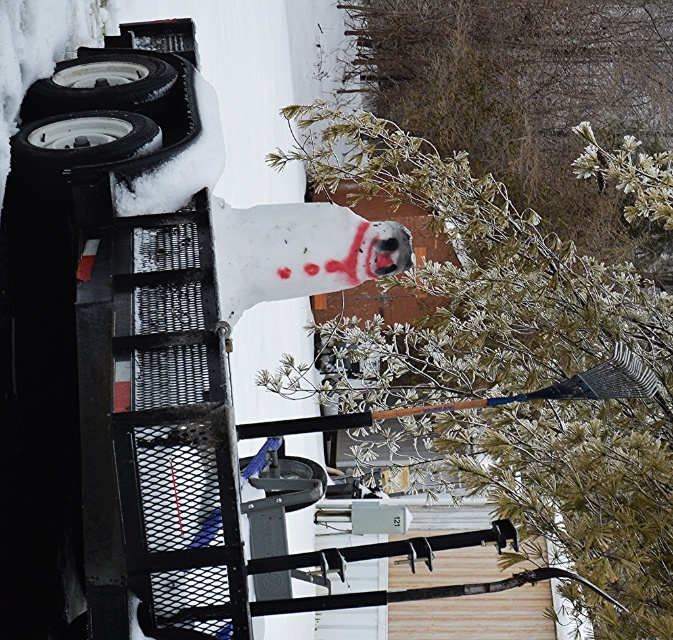
Question: Is frosted pine branches at upper center bigger than white rubber tire at upper left?

Choices:
 (A) yes
 (B) no

Answer: (A)

Question: Which of the following is the closest to the observer?

Choices:
 (A) (470, 420)
 (B) (283, 228)

Answer: (B)

Question: Among these objects, which one is farthest from the camera?

Choices:
 (A) white rubber tire at upper left
 (B) frosted pine branches at upper center

Answer: (B)

Question: Considering the relative positions of snow-covered pine at center and frosted pine branches at upper center in the image provided, where is snow-covered pine at center located with respect to frosted pine branches at upper center?

Choices:
 (A) below
 (B) above

Answer: (A)

Question: Estimate the real-world distances between objects in this image. Which object is farther from the snow-covered pine at center?

Choices:
 (A) white rubber tire at left
 (B) white painted skull at center

Answer: (A)

Question: Is snow-covered pine at center further to the viewer compared to white rubber tire at left?

Choices:
 (A) no
 (B) yes

Answer: (B)